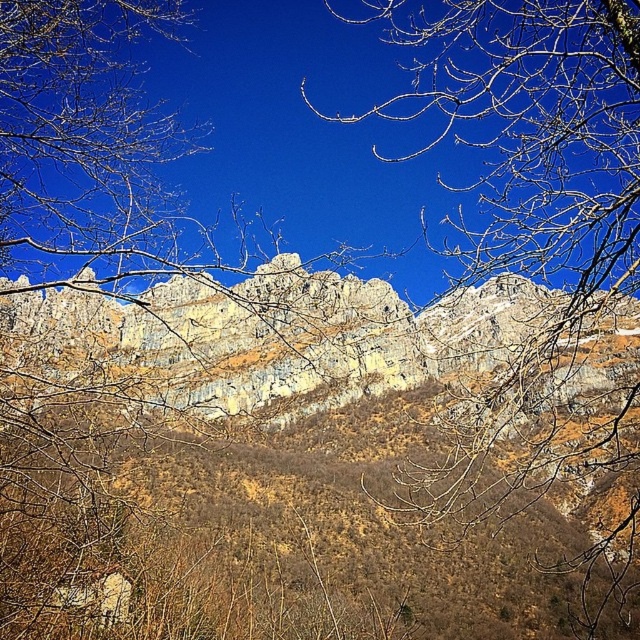
You are an artist planning to paint this mountain landscape. You want to emphasize the contrast between the bare branches at upper center and the rugged stone mountain at center. Which object should you make larger in your painting to achieve this effect?

To emphasize the contrast between the bare branches at upper center and the rugged stone mountain at center, you should make the bare branches at upper center larger in your painting since they are already larger compared to the rugged stone mountain at center in the scene.